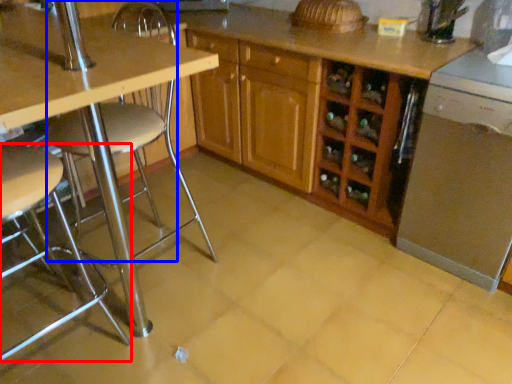
Question: Among these objects, which one is nearest to the camera, chair (highlighted by a red box) or swivel chair (highlighted by a blue box)?

Choices:
 (A) chair
 (B) swivel chair

Answer: (A)